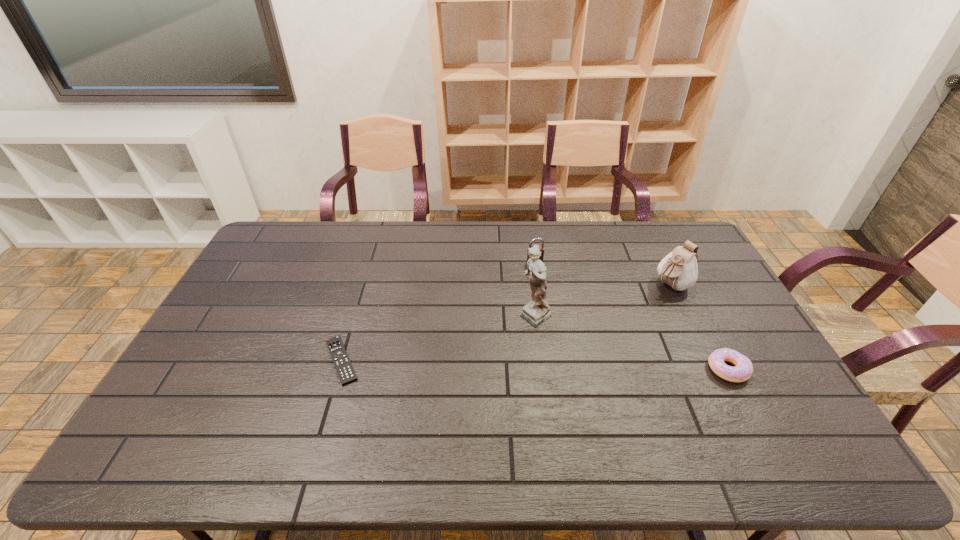
You are a GUI agent. You are given a task and a screenshot of the screen. Output one action in this format:
    pyautogui.click(x=<x>, y=<y>)
    Task: Click on the vacant space on the desktop that is between the remote control and the doughnut and is positioned on the front-facing side of the padlock
    
    Given the screenshot: What is the action you would take?
    pyautogui.click(x=588, y=366)

This screenshot has width=960, height=540. In order to click on vacant space on the desktop that is between the shortest object and the doughnut and is positioned on the front-facing side of the tallest object in this screenshot , I will do `click(479, 363)`.

Locate an element on the screen. The image size is (960, 540). free space on the desktop that is between the leftmost object and the second shortest object and is positioned on the front-facing side of the second tallest object is located at coordinates (556, 365).